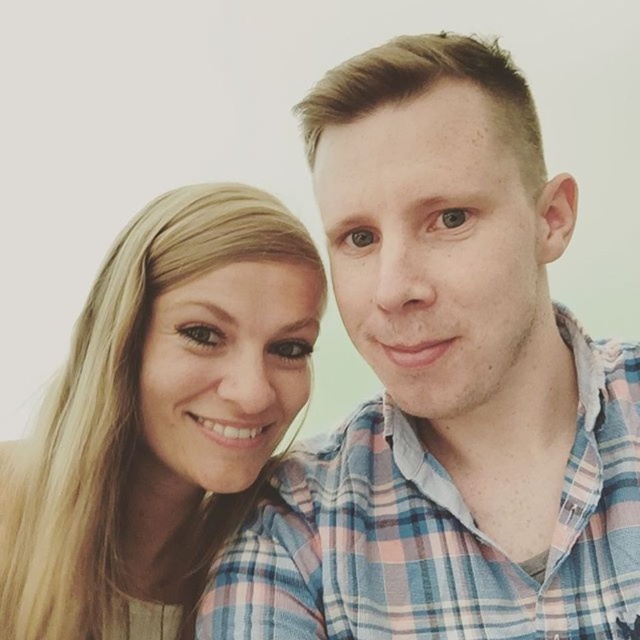
Is plaid shirt at center wider than blonde hair at upper left?

Yes, plaid shirt at center is wider than blonde hair at upper left.

Describe the element at coordinates (445, 385) in the screenshot. I see `plaid shirt at center` at that location.

Find the location of `plaid shirt at center`. plaid shirt at center is located at coordinates (445, 385).